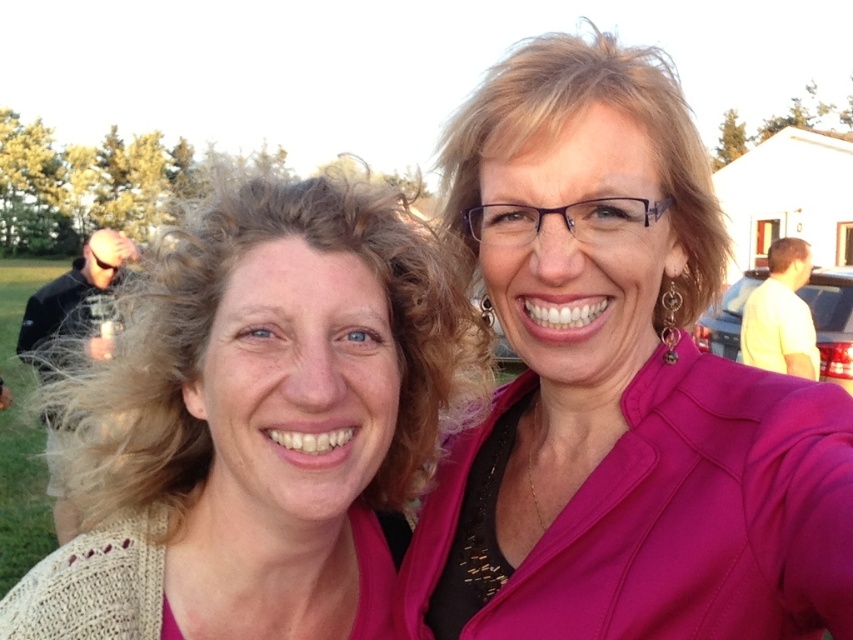
You are taking a photo of two women posing for a selfie. The first woman is at point (785, 493) and the second is at point (250, 381). Which woman is closer to the camera?

The woman at point (785, 493) is closer to the camera than the woman at point (250, 381).

You are a fashion designer analyzing the outfits in the image. Which item of clothing has a taller height measurement between the pink matte blazer at upper right and the knitted beige sweater at left?

The pink matte blazer at upper right has a greater height compared to the knitted beige sweater at left, so the pink matte blazer at upper right is taller.